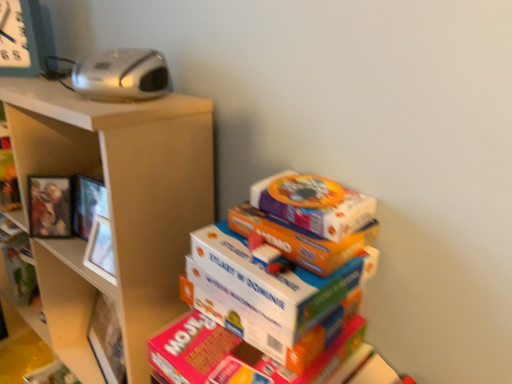
Image resolution: width=512 pixels, height=384 pixels. Describe the element at coordinates (270, 286) in the screenshot. I see `multicolored cardboard boxes at center` at that location.

You are a GUI agent. You are given a task and a screenshot of the screen. Output one action in this format:
    pyautogui.click(x=<x>, y=<y>)
    Task: Click on the matte brown shelf at upper left, arranged as the 2th shelf when viewed from the top
    
    Given the screenshot: What is the action you would take?
    pyautogui.click(x=115, y=207)

From a real-world perspective, does wooden photo frame at left sit lower than matte brown shelf at upper left, the 1th shelf ordered from the bottom?

No, from a real-world perspective, wooden photo frame at left is not beneath matte brown shelf at upper left, the 1th shelf ordered from the bottom.

Can you confirm if wooden photo frame at left is positioned to the left of matte brown shelf at upper left, the 1th shelf ordered from the bottom?

No.

Could matte brown shelf at upper left, arranged as the 2th shelf when viewed from the top, be considered to be inside wooden photo frame at left?

No, wooden photo frame at left does not contain matte brown shelf at upper left, arranged as the 2th shelf when viewed from the top.

In the scene shown: Can you tell me how much metallic gray clock at upper left and wooden photo frame at left differ in facing direction?

The angle between the facing direction of metallic gray clock at upper left and the facing direction of wooden photo frame at left is 11.3 degrees.

Does metallic gray clock at upper left contain wooden photo frame at left?

No, metallic gray clock at upper left does not contain wooden photo frame at left.

How much distance is there between metallic gray clock at upper left and wooden photo frame at left?

metallic gray clock at upper left is 13.98 inches from wooden photo frame at left.

From a real-world perspective, is metallic gray clock at upper left on top of wooden photo frame at left?

Yes, from a real-world perspective, metallic gray clock at upper left is above wooden photo frame at left.

Is multicolored cardboard boxes at center positioned with its back to wooden shelf at left, the first shelf when ordered from top to bottom?

That's not correct — multicolored cardboard boxes at center is not looking away from wooden shelf at left, the first shelf when ordered from top to bottom.

Between multicolored cardboard boxes at center and wooden shelf at left, placed as the second shelf when sorted from bottom to top, which one has smaller size?

wooden shelf at left, placed as the second shelf when sorted from bottom to top, is smaller.

In the image, is multicolored cardboard boxes at center on the left side or the right side of wooden shelf at left, the first shelf when ordered from top to bottom?

→ In the image, multicolored cardboard boxes at center appears on the right side of wooden shelf at left, the first shelf when ordered from top to bottom.

In the scene shown: Is multicolored cardboard boxes at center not within wooden shelf at left, placed as the second shelf when sorted from bottom to top?

Absolutely, multicolored cardboard boxes at center is external to wooden shelf at left, placed as the second shelf when sorted from bottom to top.

Is the surface of matte brown shelf at upper left, arranged as the 2th shelf when viewed from the top, in direct contact with silver plastic radio at upper left?

matte brown shelf at upper left, arranged as the 2th shelf when viewed from the top, is not next to silver plastic radio at upper left, and they're not touching.

Does matte brown shelf at upper left, arranged as the 2th shelf when viewed from the top, have a lesser width compared to silver plastic radio at upper left?

No, matte brown shelf at upper left, arranged as the 2th shelf when viewed from the top, is not thinner than silver plastic radio at upper left.

Measure the distance between matte brown shelf at upper left, the 1th shelf ordered from the bottom, and silver plastic radio at upper left.

matte brown shelf at upper left, the 1th shelf ordered from the bottom, and silver plastic radio at upper left are 10.37 inches apart from each other.

Between matte brown shelf at upper left, arranged as the 2th shelf when viewed from the top, and silver plastic radio at upper left, which one appears on the left side from the viewer's perspective?

matte brown shelf at upper left, arranged as the 2th shelf when viewed from the top.

Considering the positions of objects multicolored cardboard boxes at center and wooden photo frame at left in the image provided, who is more to the right, multicolored cardboard boxes at center or wooden photo frame at left?

multicolored cardboard boxes at center.

Measure the distance from multicolored cardboard boxes at center to wooden photo frame at left.

They are 24.47 inches apart.

Is multicolored cardboard boxes at center not inside wooden photo frame at left?

Yes, multicolored cardboard boxes at center is outside of wooden photo frame at left.

Is multicolored cardboard boxes at center wider than wooden photo frame at left?

Yes, multicolored cardboard boxes at center is wider than wooden photo frame at left.

From a real-world perspective, is silver plastic radio at upper left physically below metallic gray clock at upper left?

Yes.

How many degrees apart are the facing directions of silver plastic radio at upper left and metallic gray clock at upper left?

4.7 degrees separate the facing orientations of silver plastic radio at upper left and metallic gray clock at upper left.

Considering the sizes of silver plastic radio at upper left and metallic gray clock at upper left in the image, is silver plastic radio at upper left taller or shorter than metallic gray clock at upper left?

Considering their sizes, silver plastic radio at upper left has less height than metallic gray clock at upper left.

From a real-world perspective, which is physically below, wooden shelf at left, placed as the second shelf when sorted from bottom to top, or multicolored cardboard boxes at center?

wooden shelf at left, placed as the second shelf when sorted from bottom to top.

Considering their positions, is wooden shelf at left, the first shelf when ordered from top to bottom, located in front of or behind multicolored cardboard boxes at center?

Clearly, wooden shelf at left, the first shelf when ordered from top to bottom, is behind multicolored cardboard boxes at center.

Is wooden shelf at left, the first shelf when ordered from top to bottom, to the left of multicolored cardboard boxes at center from the viewer's perspective?

Yes, wooden shelf at left, the first shelf when ordered from top to bottom, is to the left of multicolored cardboard boxes at center.

Is wooden shelf at left, placed as the second shelf when sorted from bottom to top, looking in the opposite direction of multicolored cardboard boxes at center?

No.

The height and width of the screenshot is (384, 512). In order to click on picture frame to the right of matte brown shelf at upper left, the 1th shelf ordered from the bottom in this screenshot , I will do `click(50, 206)`.

Image resolution: width=512 pixels, height=384 pixels. I want to click on clock that is above the wooden photo frame at left (from the image's perspective), so click(22, 39).

Considering their positions, is wooden photo frame at left positioned further to matte brown shelf at upper left, arranged as the 2th shelf when viewed from the top, than silver plastic radio at upper left?

Based on the image, silver plastic radio at upper left appears to be further to matte brown shelf at upper left, arranged as the 2th shelf when viewed from the top.

From the image, which object appears to be farther from wooden shelf at left, the first shelf when ordered from top to bottom, multicolored cardboard boxes at center or silver plastic radio at upper left?

The object further to wooden shelf at left, the first shelf when ordered from top to bottom, is multicolored cardboard boxes at center.

Based on their spatial positions, is silver plastic radio at upper left or wooden photo frame at left further from metallic gray clock at upper left?

The object further to metallic gray clock at upper left is silver plastic radio at upper left.

Based on their spatial positions, is metallic gray clock at upper left or matte brown shelf at upper left, arranged as the 2th shelf when viewed from the top, further from wooden shelf at left, the first shelf when ordered from top to bottom?

metallic gray clock at upper left.

Looking at this image, which object lies nearer to the anchor point metallic gray clock at upper left, wooden photo frame at left or wooden shelf at left, the first shelf when ordered from top to bottom?

wooden photo frame at left lies closer to metallic gray clock at upper left than the other object.

Based on their spatial positions, is silver plastic radio at upper left or metallic gray clock at upper left further from wooden shelf at left, placed as the second shelf when sorted from bottom to top?

silver plastic radio at upper left lies further to wooden shelf at left, placed as the second shelf when sorted from bottom to top, than the other object.

From the image, which object appears to be farther from silver plastic radio at upper left, multicolored cardboard boxes at center or metallic gray clock at upper left?

multicolored cardboard boxes at center lies further to silver plastic radio at upper left than the other object.

Looking at the image, which one is located further to matte brown shelf at upper left, the 1th shelf ordered from the bottom, wooden photo frame at left or metallic gray clock at upper left?

Among the two, metallic gray clock at upper left is located further to matte brown shelf at upper left, the 1th shelf ordered from the bottom.

Find the location of a particular element. The height and width of the screenshot is (384, 512). picture frame located between matte brown shelf at upper left, the 1th shelf ordered from the bottom, and wooden shelf at left, placed as the second shelf when sorted from bottom to top, in the depth direction is located at coordinates (50, 206).

Identify the location of radio located between wooden photo frame at left and multicolored cardboard boxes at center in the left-right direction. The height and width of the screenshot is (384, 512). (121, 75).

I want to click on bundle between silver plastic radio at upper left and matte brown shelf at upper left, the 1th shelf ordered from the bottom, in the up-down direction, so click(270, 286).

The height and width of the screenshot is (384, 512). In order to click on radio that lies between metallic gray clock at upper left and matte brown shelf at upper left, the 1th shelf ordered from the bottom, from top to bottom in this screenshot , I will do coord(121,75).